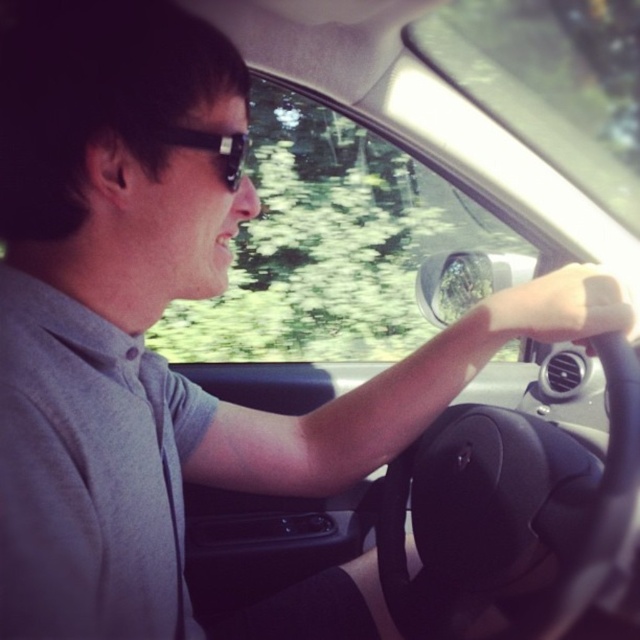
You are a passenger in the car and want to adjust the air vent. The black rubber steering wheel at center is blocking your view of the air vent controls. Can you move the slightly translucent skin at steering wheel center to access them?

The black rubber steering wheel at center is in front of slightly translucent skin at steering wheel center, so moving the slightly translucent skin at steering wheel center would not help access the air vent controls since it is behind the steering wheel.